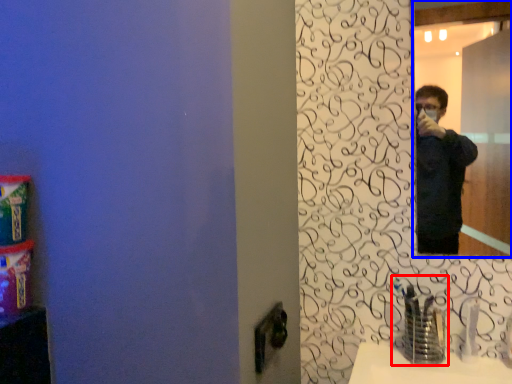
Question: Which object is closer to the camera taking this photo, faucet (highlighted by a red box) or mirror (highlighted by a blue box)?

Choices:
 (A) faucet
 (B) mirror

Answer: (A)